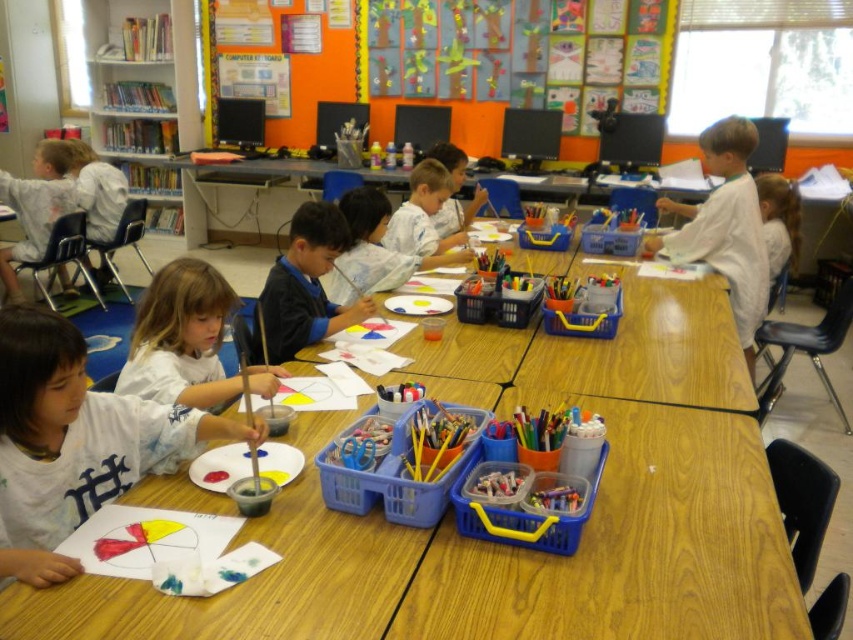
You are a teacher observing the classroom. You notice the colorful paper art at upper center and the matte white shirt at center. Which object is positioned higher in the image?

The colorful paper art at upper center is positioned higher than the matte white shirt at center.

You are a student standing in the classroom and want to reach the point marked at coordinates point (283,576). If you can extend your arm 1.2 meters, will you be able to touch that point?

The distance between you and point (283,576) is 1.27 meters, which is slightly longer than your arm reach of 1.2 meters. Therefore, you cannot touch the point with your arm.